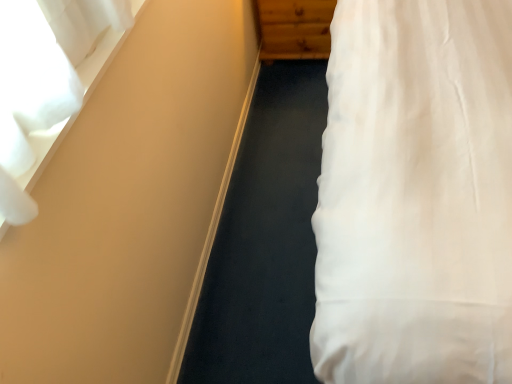
I want to click on empty space that is ontop of white sheer curtain at upper left, so click(x=80, y=96).